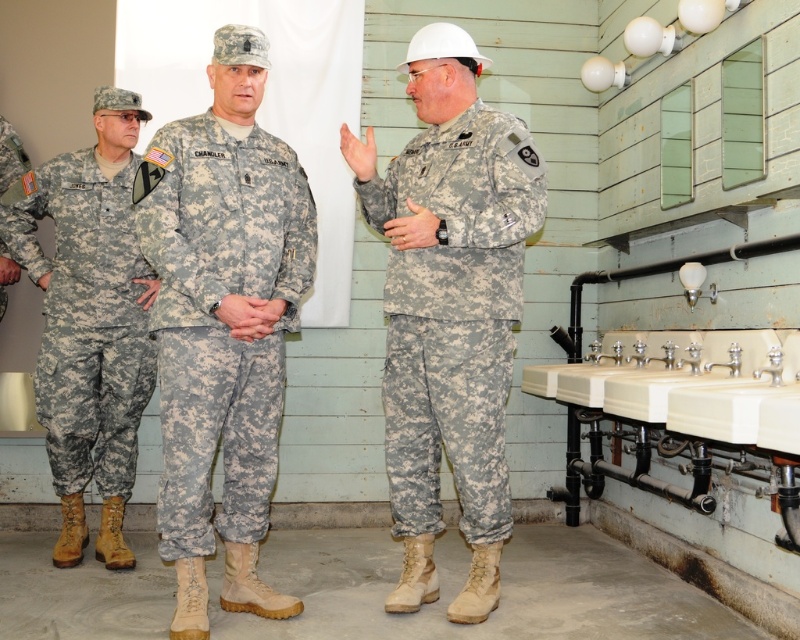
What do you see at coordinates (222, 321) in the screenshot?
I see `camouflage fabric pants at center` at bounding box center [222, 321].

Does camouflage fabric pants at center appear over camouflage fabric pants at left?

Incorrect, camouflage fabric pants at center is not positioned above camouflage fabric pants at left.

Is point (277, 342) positioned before point (61, 300)?

Yes, point (277, 342) is closer to viewer.

The height and width of the screenshot is (640, 800). What are the coordinates of `camouflage fabric pants at center` in the screenshot? It's located at (222, 321).

Who is more distant from viewer, (137, 330) or (788, 436)?

The point (137, 330) is more distant.

From the picture: Is camouflage fabric pants at left taller than white ceramic sink at lower right?

Correct, camouflage fabric pants at left is much taller as white ceramic sink at lower right.

Is point (98, 332) more distant than point (640, 394)?

Yes, point (98, 332) is behind point (640, 394).

Find the location of a particular element. The height and width of the screenshot is (640, 800). camouflage fabric pants at left is located at coordinates (86, 317).

Does camouflage fabric uniform at center lie in front of white ceramic sink at lower right?

No, it is behind white ceramic sink at lower right.

Is point (425, 256) in front of point (788, 362)?

No, (425, 256) is behind (788, 362).

Which is behind, point (454, 216) or point (536, 381)?

Positioned behind is point (536, 381).

Where is `camouflage fabric uniform at center`? camouflage fabric uniform at center is located at coordinates (454, 314).